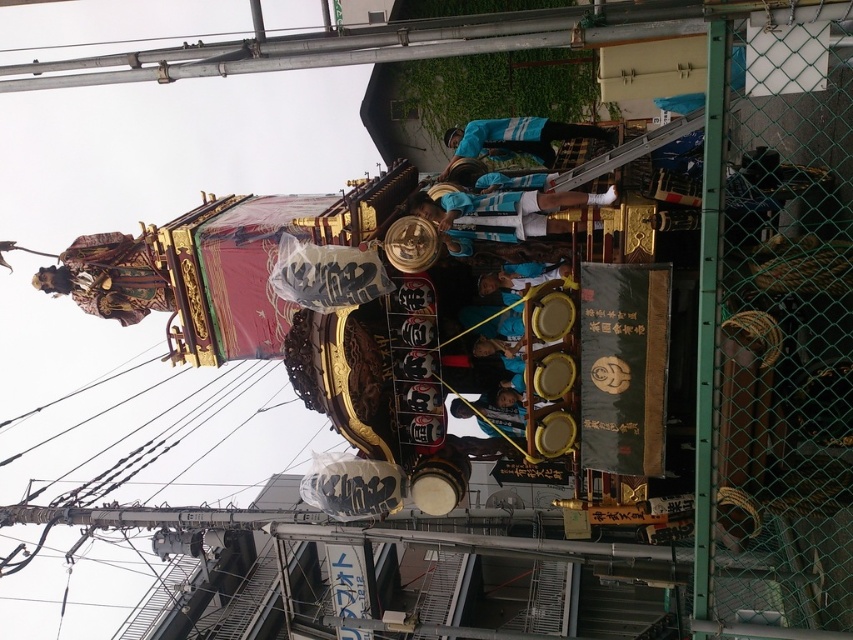
Question: Which point is farther from the camera taking this photo?

Choices:
 (A) (473, 134)
 (B) (845, 172)

Answer: (A)

Question: Is green chain-link fence at right positioned at the back of white jersey at center?

Choices:
 (A) no
 (B) yes

Answer: (A)

Question: Is white jersey at center smaller than blue fabric skateboarder at center?

Choices:
 (A) no
 (B) yes

Answer: (B)

Question: Is white jersey at center thinner than blue fabric skateboarder at center?

Choices:
 (A) yes
 (B) no

Answer: (A)

Question: Which of the following is the closest to the observer?

Choices:
 (A) white jersey at center
 (B) green chain-link fence at right

Answer: (B)

Question: Which point is closer to the camera?

Choices:
 (A) blue fabric skateboarder at center
 (B) green chain-link fence at right

Answer: (B)